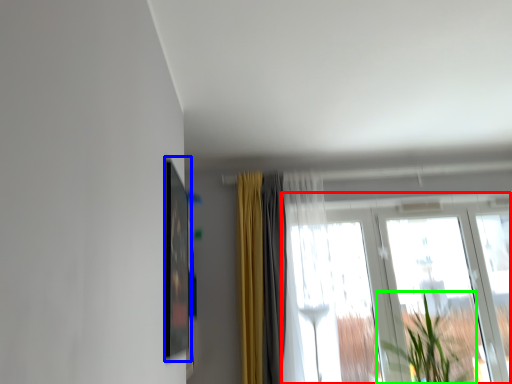
Question: Which object is the closest to the window (highlighted by a red box)? Choose among these: picture frame (highlighted by a blue box) or houseplant (highlighted by a green box).

Choices:
 (A) picture frame
 (B) houseplant

Answer: (B)